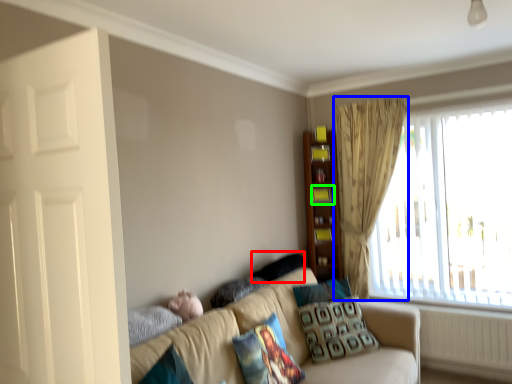
Question: Considering the real-world distances, which object is farthest from pillow (highlighted by a red box)? curtain (highlighted by a blue box) or shelf (highlighted by a green box)?

Choices:
 (A) curtain
 (B) shelf

Answer: (A)